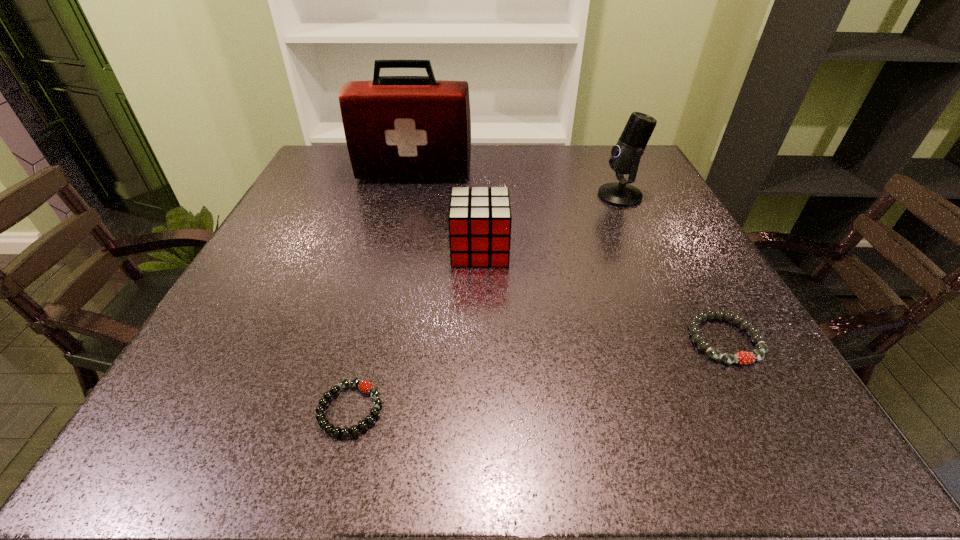
Identify which object is located as the fourth nearest to the cube. Please provide its 2D coordinates. Your answer should be formatted as a tuple, i.e. [(x, y)], where the tuple contains the x and y coordinates of a point satisfying the conditions above.

[(742, 357)]

Where is `vacant area in the image that satisfies the following two spatial constraints: 1. on the side of the first aid kit with the cross symbol; 2. on the right side of the cube`? The height and width of the screenshot is (540, 960). vacant area in the image that satisfies the following two spatial constraints: 1. on the side of the first aid kit with the cross symbol; 2. on the right side of the cube is located at coordinates (396, 250).

Where is `vacant space that satisfies the following two spatial constraints: 1. on the back side of the fourth tallest object; 2. on the stand of the microphone`? This screenshot has width=960, height=540. vacant space that satisfies the following two spatial constraints: 1. on the back side of the fourth tallest object; 2. on the stand of the microphone is located at coordinates (645, 195).

Where is `free location that satisfies the following two spatial constraints: 1. on the stand of the fourth shortest object; 2. on the front side of the shorter bracelet`? This screenshot has width=960, height=540. free location that satisfies the following two spatial constraints: 1. on the stand of the fourth shortest object; 2. on the front side of the shorter bracelet is located at coordinates (718, 409).